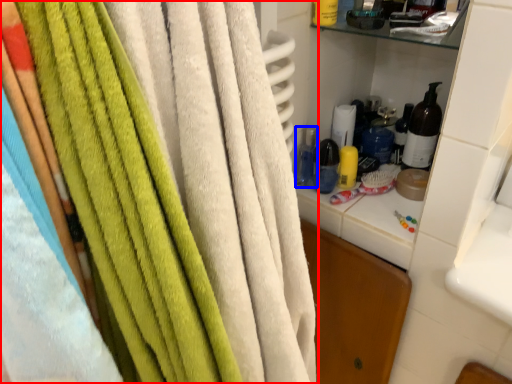
Question: Which point is further to the camera, towel (highlighted by a red box) or bottle (highlighted by a blue box)?

Choices:
 (A) towel
 (B) bottle

Answer: (B)